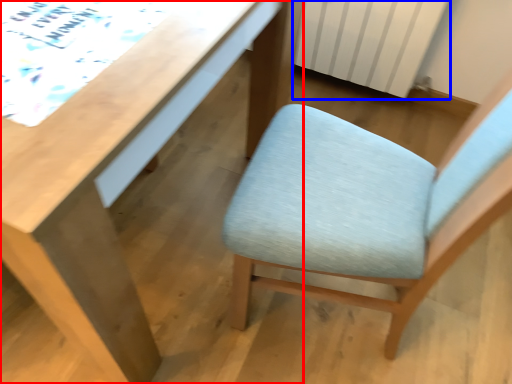
Question: Which object is closer to the camera taking this photo, desk (highlighted by a red box) or radiator (highlighted by a blue box)?

Choices:
 (A) desk
 (B) radiator

Answer: (A)